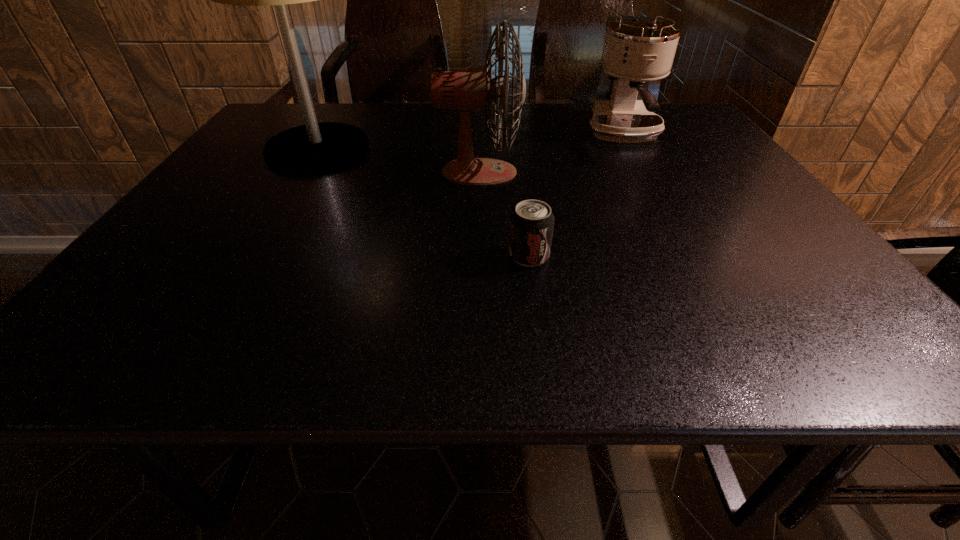
Identify the location of table lamp at the far edge. (312, 148).

The image size is (960, 540). I want to click on coffee maker located at the far edge, so click(636, 50).

Where is `object located in the left edge section of the desktop`? The height and width of the screenshot is (540, 960). object located in the left edge section of the desktop is located at coordinates (312, 148).

Where is `object that is positioned at the right edge`? object that is positioned at the right edge is located at coordinates (636, 50).

The image size is (960, 540). I want to click on object that is at the far left corner, so click(x=312, y=148).

This screenshot has height=540, width=960. What are the coordinates of `object located at the far right corner` in the screenshot? It's located at (636, 50).

Where is `vacant space at the far edge`? The height and width of the screenshot is (540, 960). vacant space at the far edge is located at coordinates (397, 129).

Find the location of a particular element. This screenshot has width=960, height=540. vacant region at the near edge of the desktop is located at coordinates (578, 321).

In the image, there is a desktop. Where is `vacant space at the right edge`? The height and width of the screenshot is (540, 960). vacant space at the right edge is located at coordinates [670, 144].

What are the coordinates of `vacant space that is in between the leftmost object and the fan` in the screenshot? It's located at [x=398, y=161].